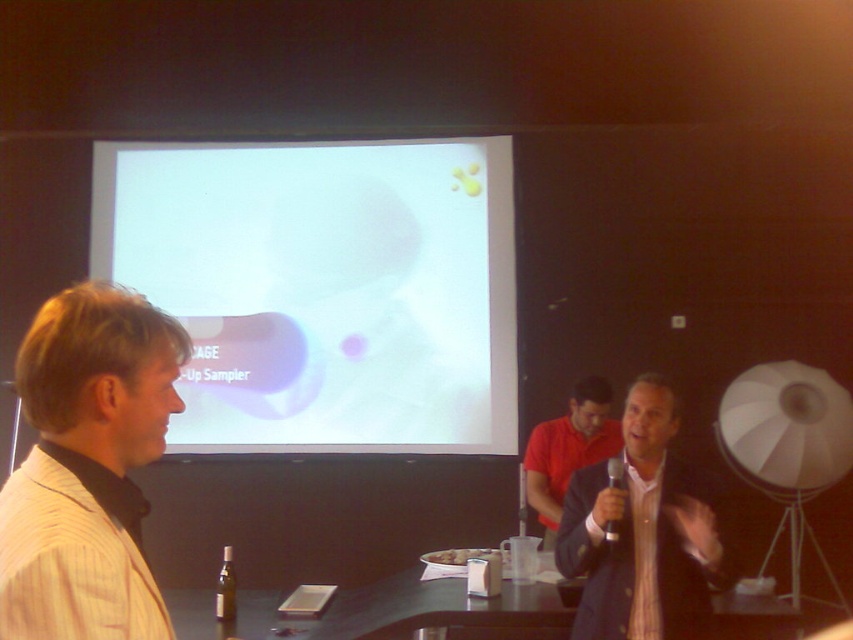
From the picture: You are an event organizer trying to arrange seating for a photo op. You need to place two guests wearing the light beige striped shirt at left and the red matte shirt at center. Based on their positions in the current image, which guest should sit closer to the front of the photo? Explain your reasoning.

The light beige striped shirt at left is above the red matte shirt at center in the image, which suggests it is positioned closer to the front. Therefore, the guest wearing the light beige striped shirt at left should sit closer to the front of the photo to maintain their original spatial relationship.

You are an attendee at the presentation. You want to take a photo of the slide on the white glossy projection screen at upper center without the red matte shirt at center blocking the view. Is the screen visible from your current position?

The white glossy projection screen at upper center is further to the viewer than the red matte shirt at center, so the screen is closer to you and the red matte shirt at center is behind it. Therefore, the screen is visible without obstruction from your current position.